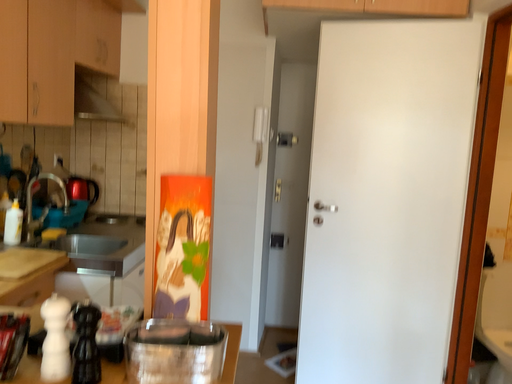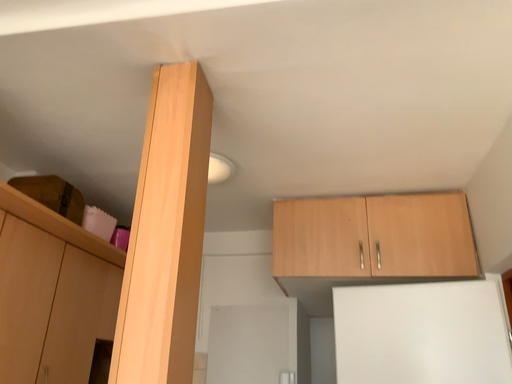
Question: How did the camera likely rotate when shooting the video?

Choices:
 (A) rotated upward
 (B) rotated downward

Answer: (A)